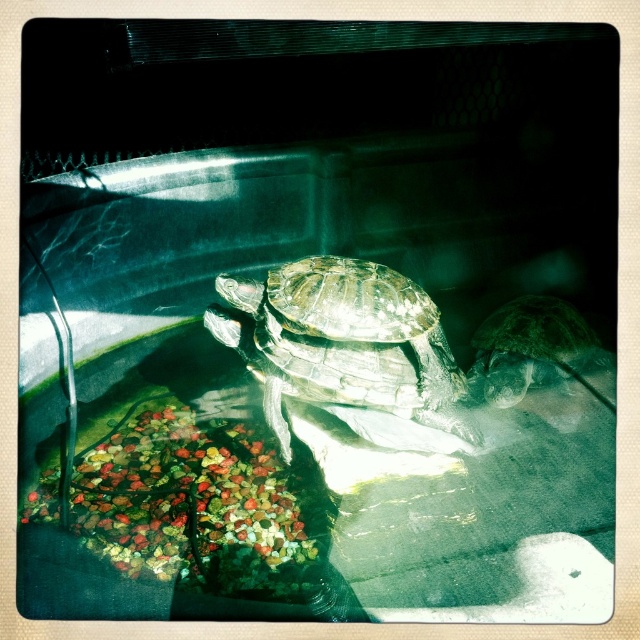
You are a caretaker checking the enclosure for the shiny brown tortoise at center and the shiny green tortoise at right. Which tortoise is positioned higher in the enclosure?

The shiny brown tortoise at center is located above the shiny green tortoise at right, so it is positioned higher in the enclosure.

You are a caretaker of the turtles in the terrarium. You need to place a new feeding dish between the shiny brown tortoise at center and the shiny green tortoise at right. Considering their sizes, which turtle should the dish be closer to?

The shiny brown tortoise at center is taller than the shiny green tortoise at right, so the feeding dish should be placed closer to the shiny brown tortoise at center to accommodate its larger size.